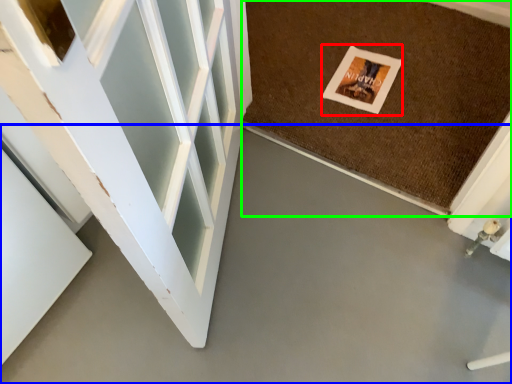
Question: Based on their relative distances, which object is farther from postcard (highlighted by a red box)? Choose from concrete (highlighted by a blue box) and mat (highlighted by a green box).

Choices:
 (A) concrete
 (B) mat

Answer: (A)